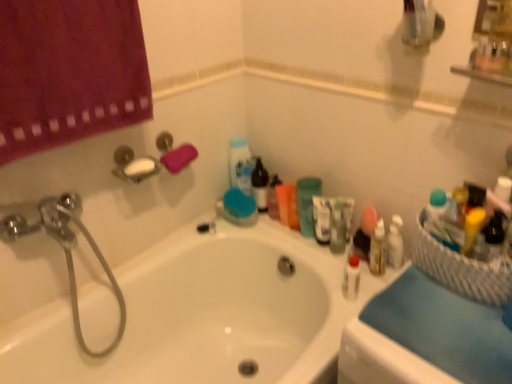
Question: From a real-world perspective, is blue fabric at right on top of green matte cup at upper center?

Choices:
 (A) yes
 (B) no

Answer: (A)

Question: Is green matte cup at upper center at the back of blue fabric at right?

Choices:
 (A) no
 (B) yes

Answer: (A)

Question: Is blue fabric at right shorter than green matte cup at upper center?

Choices:
 (A) no
 (B) yes

Answer: (B)

Question: Would you say blue fabric at right is outside green matte cup at upper center?

Choices:
 (A) no
 (B) yes

Answer: (B)

Question: Is there a large distance between blue fabric at right and green matte cup at upper center?

Choices:
 (A) yes
 (B) no

Answer: (B)

Question: From a real-world perspective, is blue fabric at right physically below green matte cup at upper center?

Choices:
 (A) yes
 (B) no

Answer: (B)

Question: Can you confirm if pink sponge at upper left is positioned to the right of white wicker basket at right?

Choices:
 (A) yes
 (B) no

Answer: (B)

Question: Considering the relative sizes of pink sponge at upper left and white wicker basket at right in the image provided, is pink sponge at upper left taller than white wicker basket at right?

Choices:
 (A) yes
 (B) no

Answer: (B)

Question: From a real-world perspective, is pink sponge at upper left under white wicker basket at right?

Choices:
 (A) no
 (B) yes

Answer: (A)

Question: Is pink sponge at upper left not inside white wicker basket at right?

Choices:
 (A) no
 (B) yes

Answer: (B)

Question: Could you tell me if pink sponge at upper left is facing white wicker basket at right?

Choices:
 (A) yes
 (B) no

Answer: (A)

Question: Is pink sponge at upper left positioned in front of white wicker basket at right?

Choices:
 (A) no
 (B) yes

Answer: (A)

Question: Is chrome metallic showerhead at upper left at the right side of blue fabric at right?

Choices:
 (A) yes
 (B) no

Answer: (B)